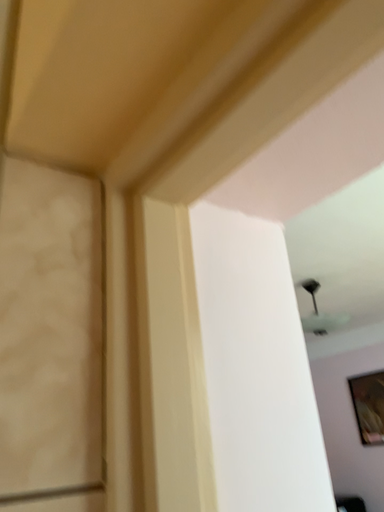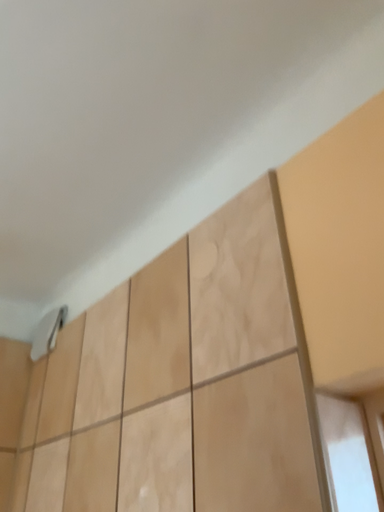
Question: How did the camera likely rotate when shooting the video?

Choices:
 (A) rotated downward
 (B) rotated upward

Answer: (B)